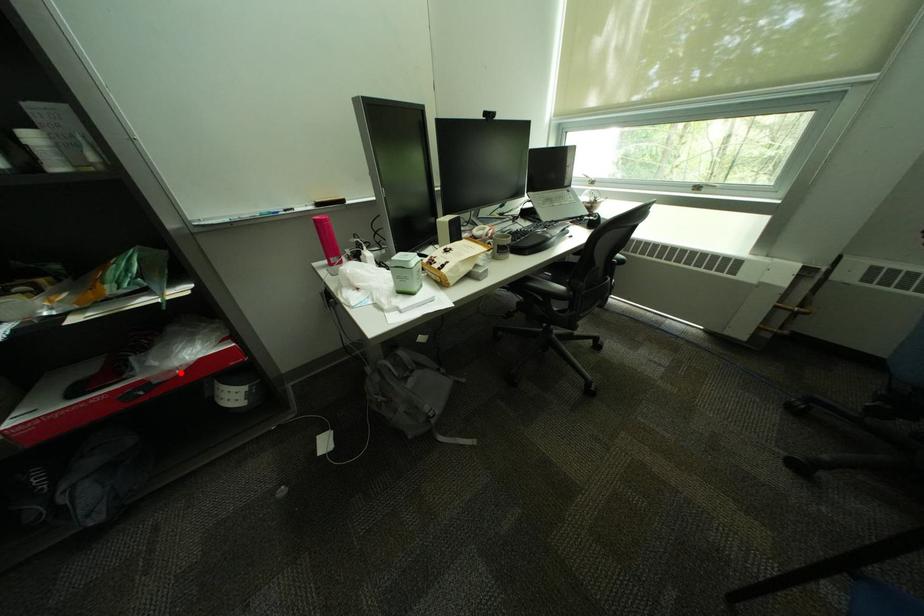
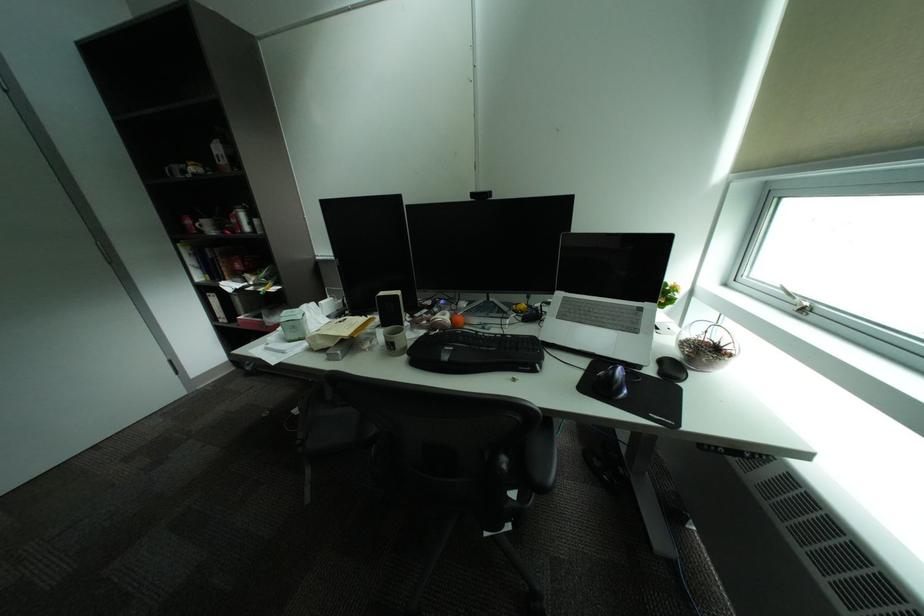
Question: I am providing you with two images of the same scene from different viewpoints. Image1 has a red point marked. In image2, the corresponding 3D location appears at what relative position? Reply with the corresponding letter.

Choices:
 (A) Closer
 (B) Farther

Answer: (B)